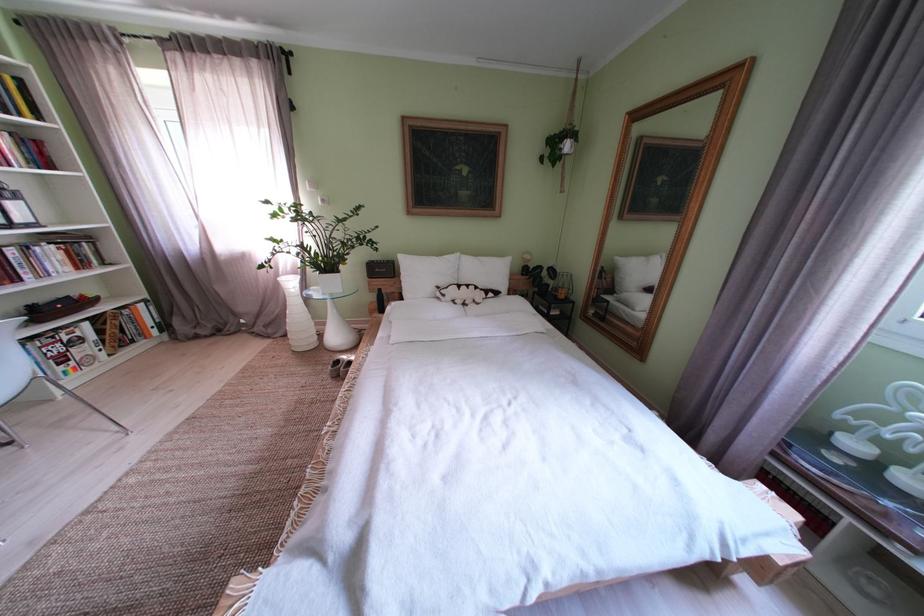
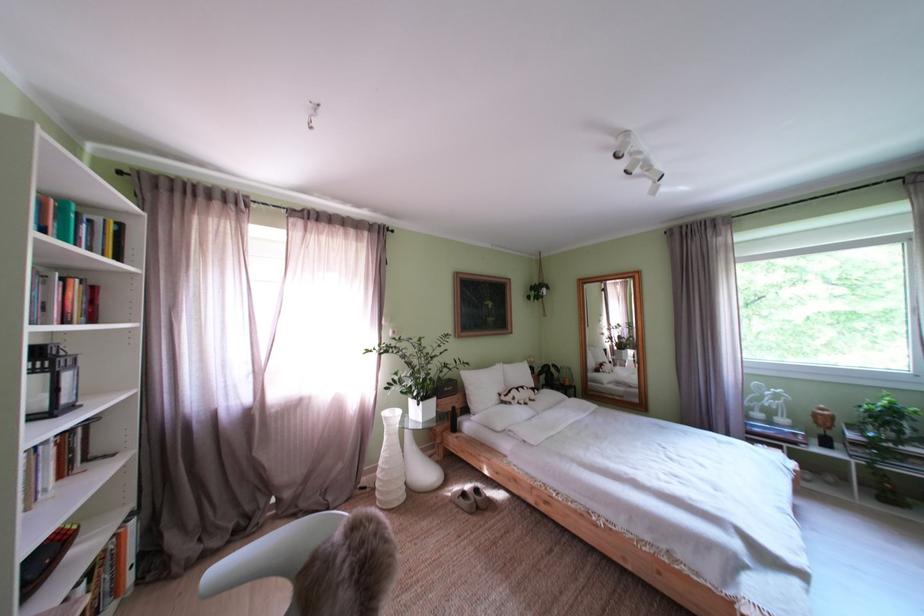
In the second image, find the point that corresponds to point 347,342 in the first image.

(438, 479)